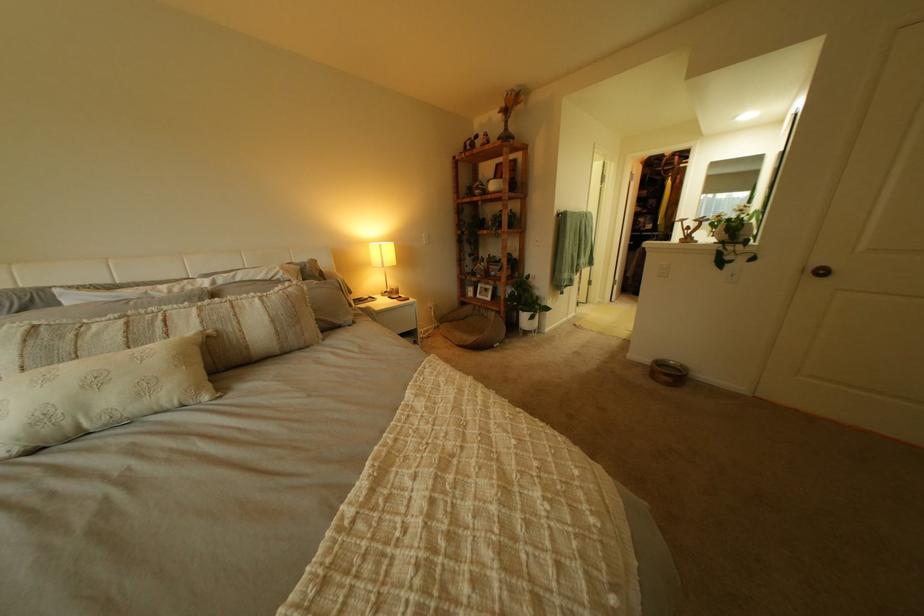
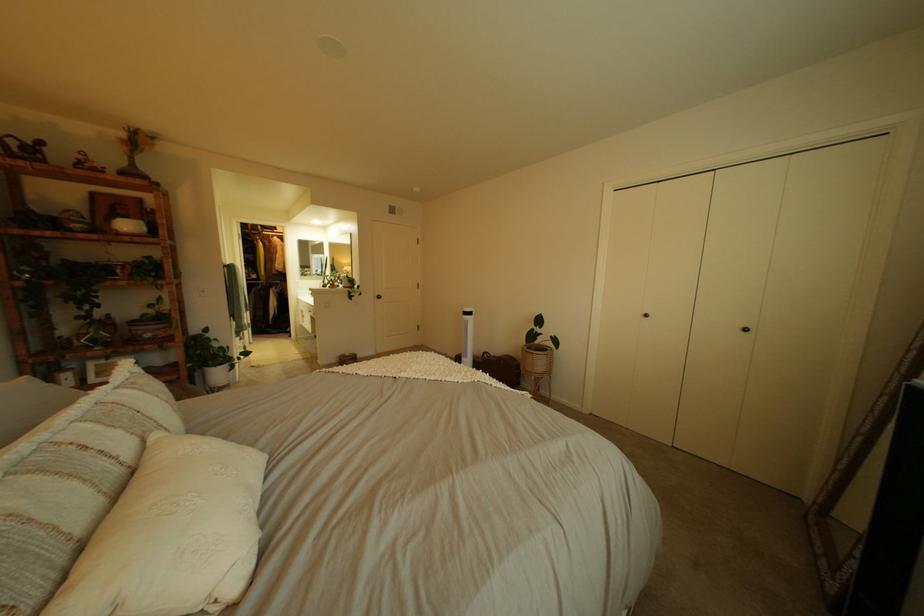
Where in the second image is the point corresponding to (213,323) from the first image?

(134, 434)